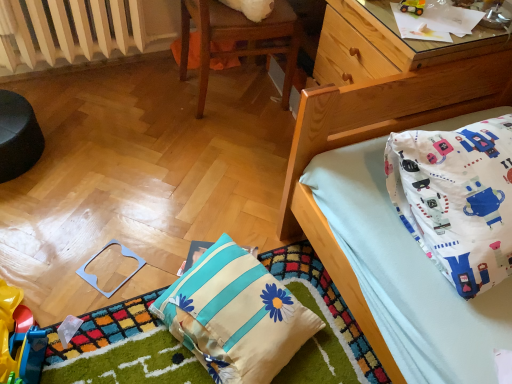
Locate an element on the screen. The width and height of the screenshot is (512, 384). free location in front of metallic yellow toy car at upper right, placed as the 1th toy when sorted from top to bottom is located at coordinates (417, 28).